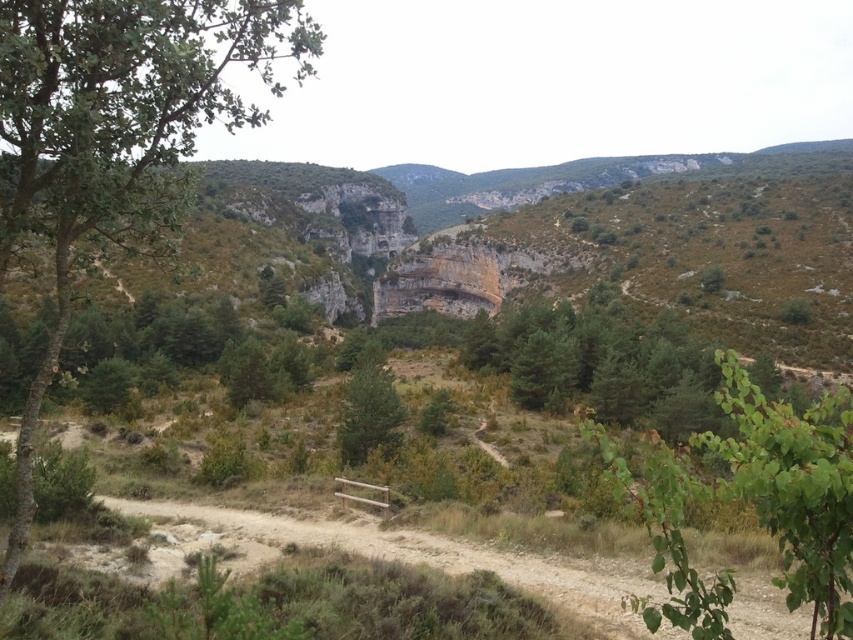
You are a hiker carrying a backpack that has a width of 30 cm. You see the green leafy branch at lower right and the green matte tree at center. Can you pass through the space between them without touching either?

The green leafy branch at lower right is wider than the green matte tree at center. Since the backpack is 30 cm wide, you need to check if the space between them is at least 30 cm. However, the description only states the branch is wider than the tree, but doesn not provide the exact distance between them. Therefore, it is uncertain whether the space is sufficient for the backpack to pass through without touching either.

You are standing at the center of the dirt path in the foreground. Looking towards the wooden fence, can you see the green leafy branch at lower right from your current position?

Yes, the green leafy branch at lower right is located at point (752, 504), which is within your line of sight from the center of the dirt path.

You are a hiker standing on the dirt path and want to take a photo of both the green leafy tree at left and the green matte tree at center. Which tree should you focus on first to ensure both are in the frame?

You should focus on the green leafy tree at left first because it is located above the green matte tree at center, so adjusting the camera angle to include both would require framing from the top down.